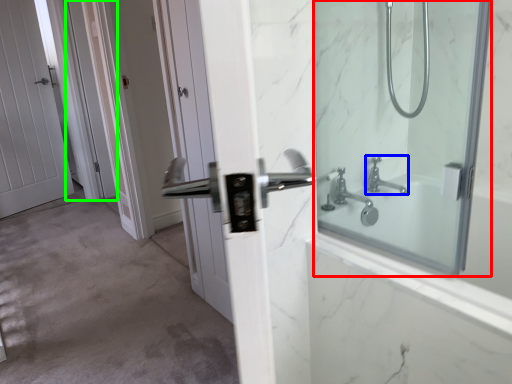
Question: Which object is the farthest from mirror (highlighted by a red box)? Choose among these: tap (highlighted by a blue box) or screen door (highlighted by a green box).

Choices:
 (A) tap
 (B) screen door

Answer: (B)